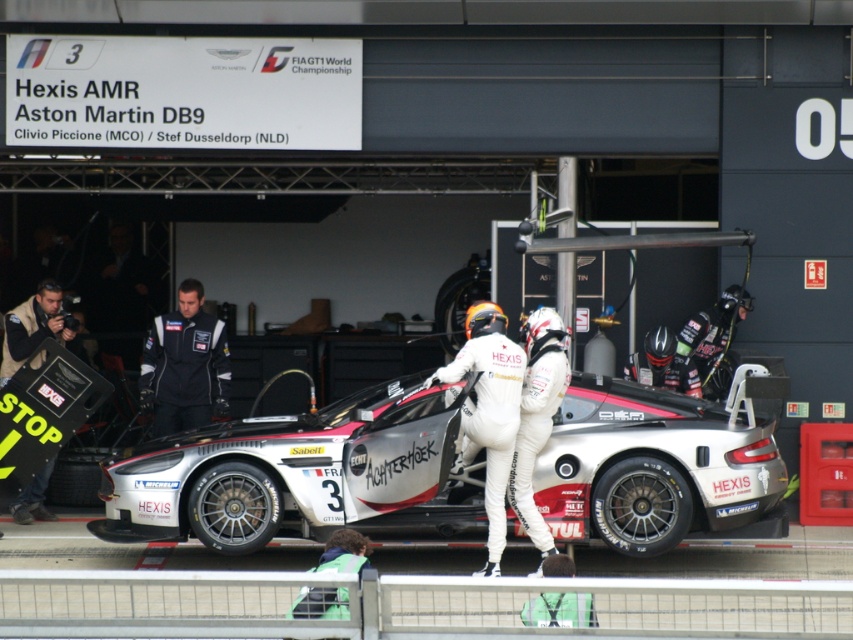
You are a photographer standing in the garage and want to take a photo of the Aston Martin DB9 race car. You notice two points marked on the car, one at point coordinates (221, 342) and another at (16, 497). Which point is closer to you when you are facing the car?

Point coordinates (221, 342) is closer to you because it is further to the viewer than point coordinates (16, 497).

You are a photographer positioned at the camera location. You need to capture a closeup shot of the black fabric suit at center. Based on the coordinates provided, where should you aim your camera to ensure the subject is centered in the frame?

The black fabric suit at center is located at coordinates point (184,365), so aim your camera at that point to center it in the frame.

You are a photographer positioned at the point marked as point (299, 474) in the garage. You need to capture a photo of the silver metallic race car at center. Is the silver metallic race car at center directly in front of you?

The silver metallic race car at center is located at point (299, 474), which is your current position. Therefore, you are standing directly where the car is, making it impossible to see it in front of you.